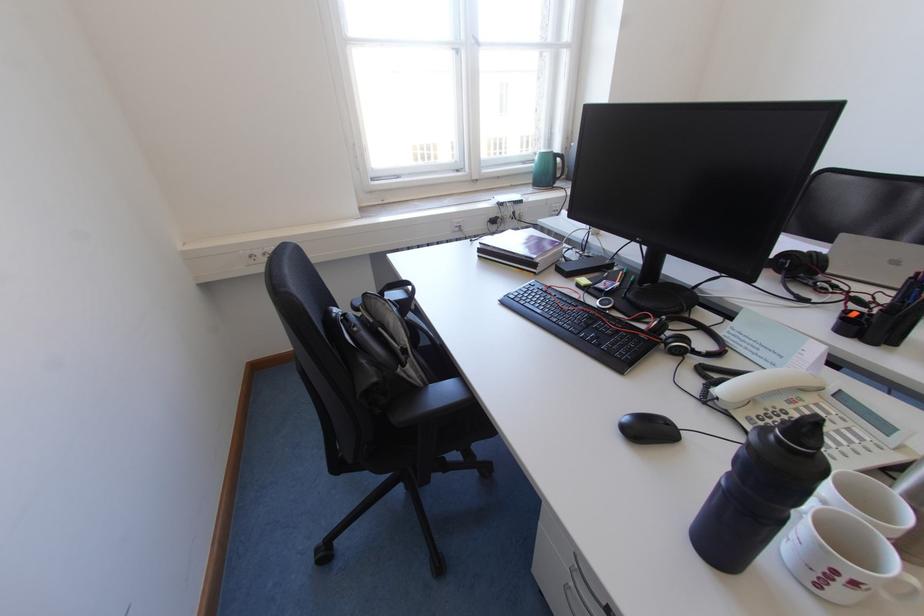
Find where to sit the chair sitting surface. Please return your answer as a coordinate pair (x, y).

(429, 403)